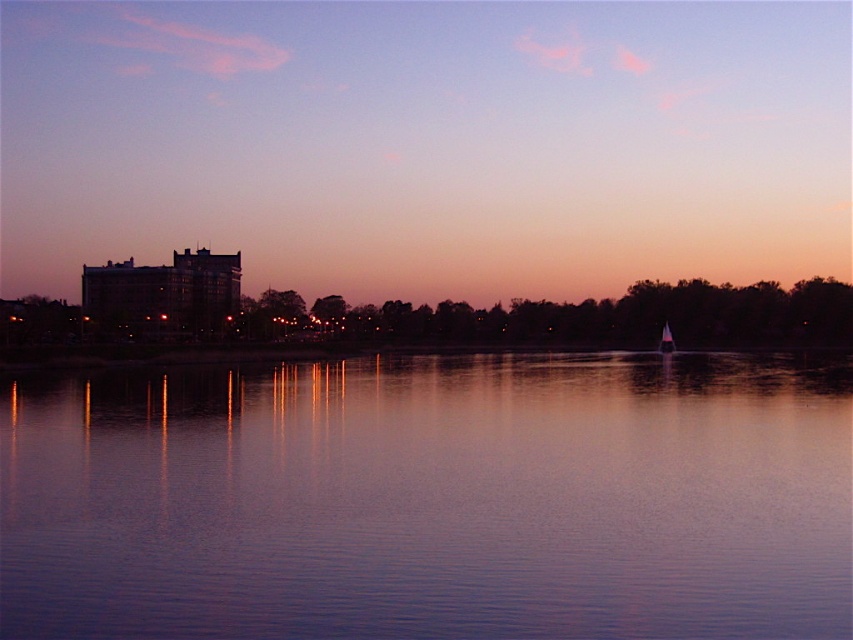
You are a photographer trying to capture the white glossy sailboat at center in your shot. You notice the purple reflective water at center might block the view. Based on the scene, can you determine if the sailboat will be visible above the water?

The white glossy sailboat at center is taller than the purple reflective water at center, so yes, the sailboat will be visible above the water.

Based on the photo, you are standing at the lakeside and looking at the scene. There are two points marked in the image, point 1 at coordinates point (62, 275) and point 2 at coordinates point (808, 515). Which point is closer to you?

Point 1 at coordinates point (62, 275) is closer to you since it is further to the camera than point 2 at coordinates point (808, 515).

You are standing at the lakeside and want to know how far the purple glass building at upper left is from your current position. Can you determine the distance?

The purple glass building at upper left is 313.37 meters away from your current position.